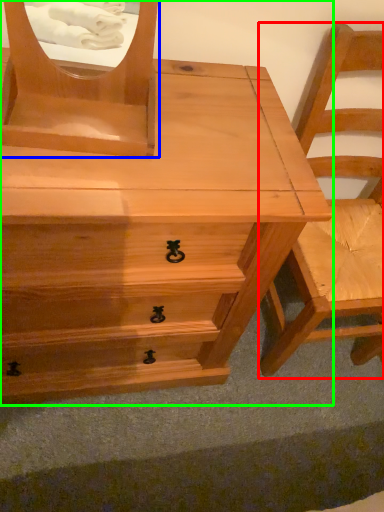
Question: Which object is the closest to the chair (highlighted by a red box)? Choose among these: mirror (highlighted by a blue box) or chest of drawers (highlighted by a green box).

Choices:
 (A) mirror
 (B) chest of drawers

Answer: (B)